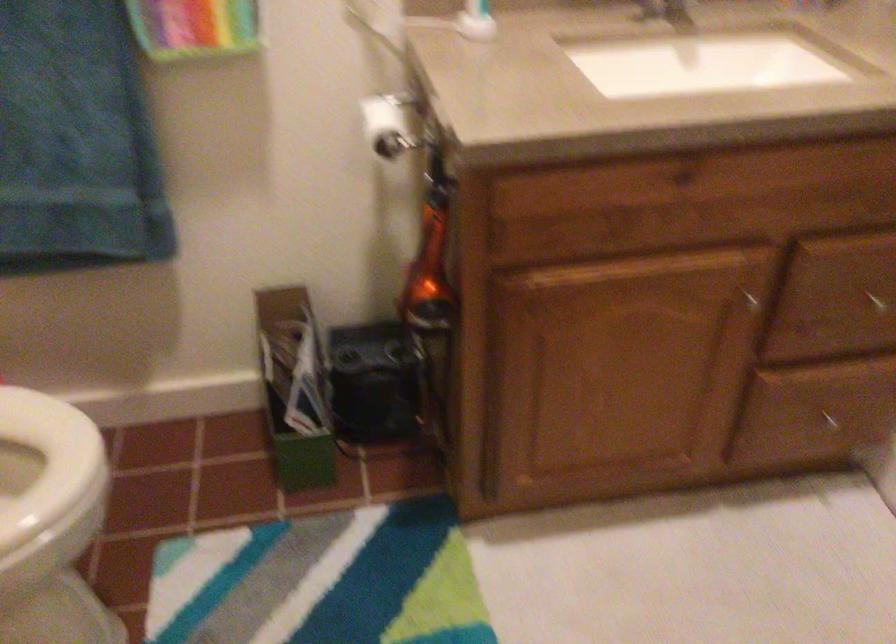
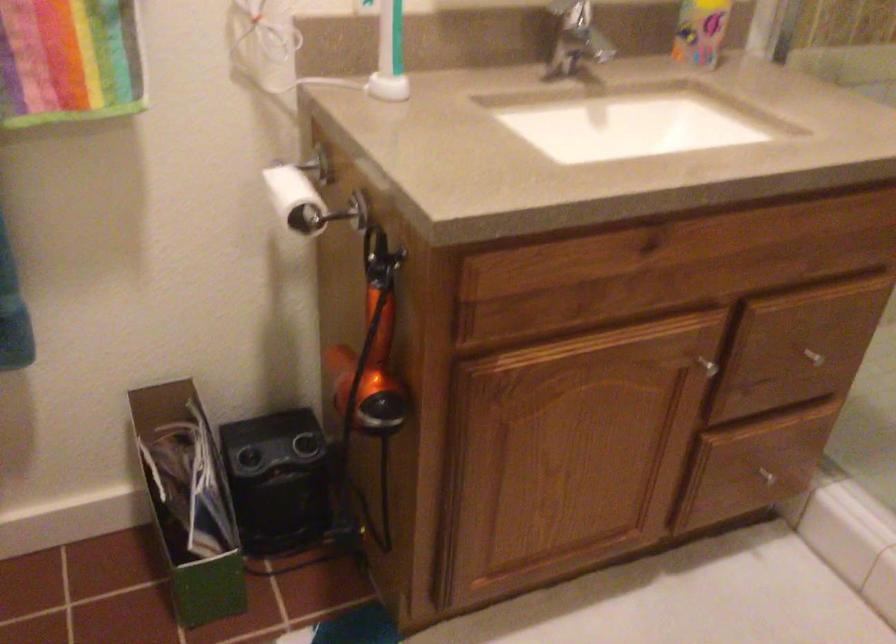
What movement of the cameraman would produce the second image?

The cameraman walked toward left, forward.